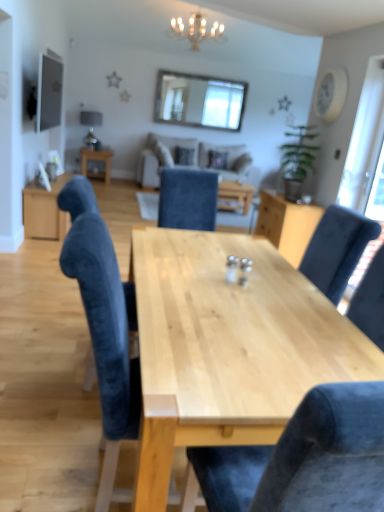
Locate an element on the screen. Image resolution: width=384 pixels, height=512 pixels. free point above natural wood table at center, the 2th table positioned from the left (from a real-world perspective) is located at coordinates (252, 318).